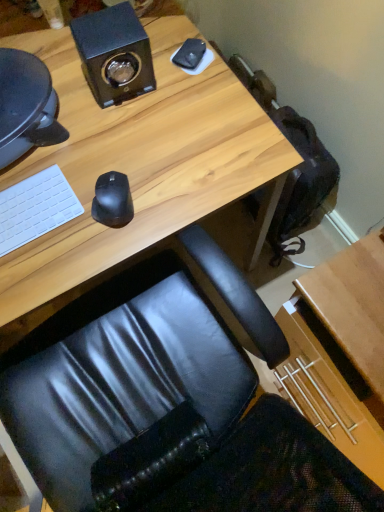
Locate an element on the screen. The image size is (384, 512). free space to the left of black matte speaker at upper left is located at coordinates (66, 71).